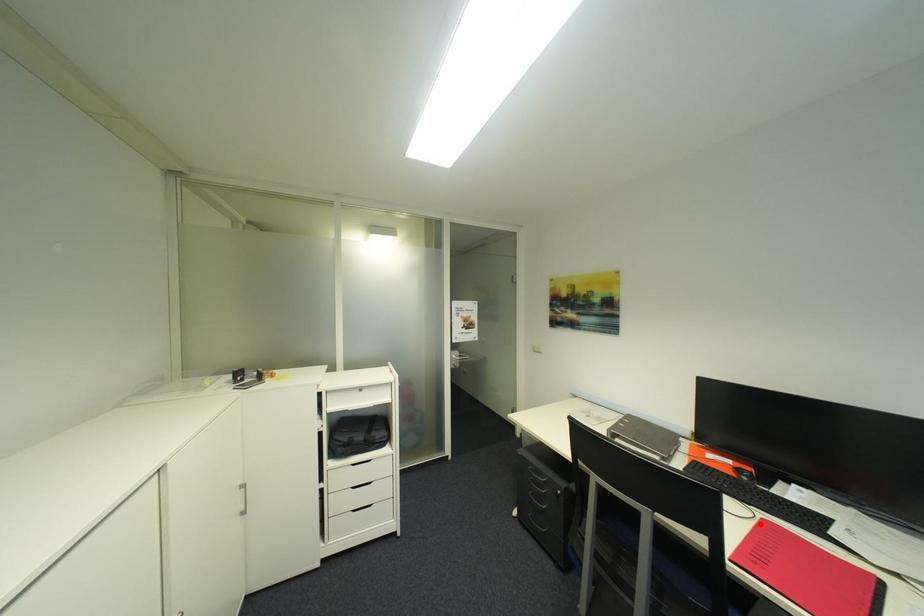
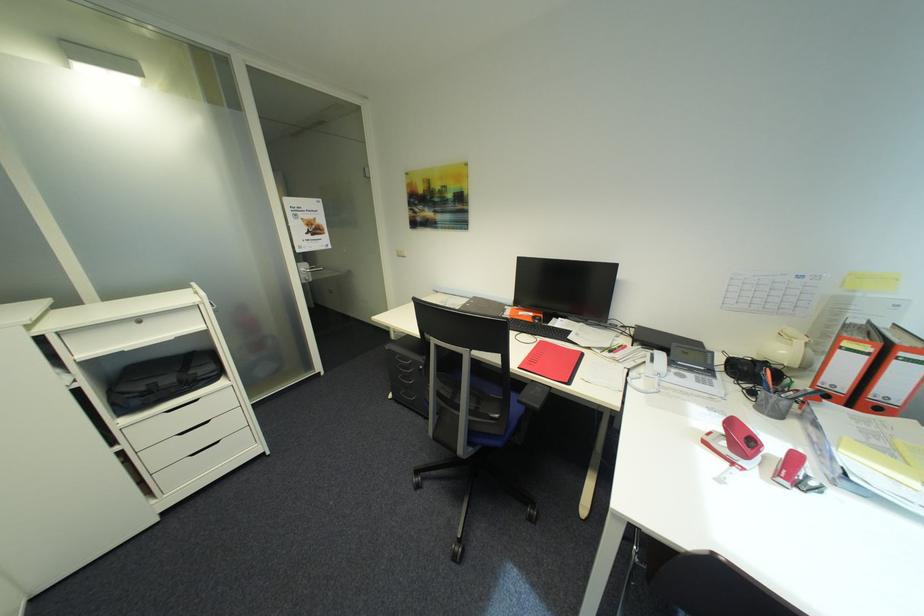
Question: I am providing you with two images of the same scene from different viewpoints. Given a red point in image1, look at the same physical point in image2. Is it:

Choices:
 (A) Closer to the viewpoint
 (B) Farther from the viewpoint

Answer: (B)